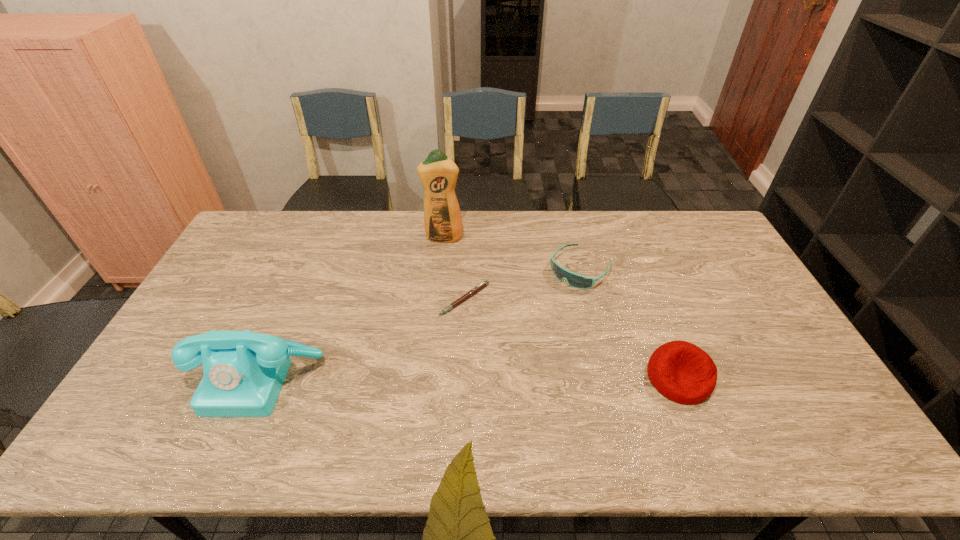
Identify the location of vacant region located at the nib of the shortest object. This screenshot has width=960, height=540. (478, 354).

You are a GUI agent. You are given a task and a screenshot of the screen. Output one action in this format:
    pyautogui.click(x=<x>, y=<y>)
    Task: Click on the free space located 0.080m at the nib of the shortest object
    
    Given the screenshot: What is the action you would take?
    pyautogui.click(x=474, y=338)

Identify the location of blank space located 0.150m on the front-facing side of the second shortest object. (537, 312).

Find the location of a particular element. free space located on the front-facing side of the second shortest object is located at coordinates (491, 357).

Locate an element on the screen. The height and width of the screenshot is (540, 960). vacant region located 0.160m on the front-facing side of the second shortest object is located at coordinates (535, 314).

Locate an element on the screen. free spot located on the label of the tallest object is located at coordinates (442, 331).

This screenshot has height=540, width=960. I want to click on free space located on the label of the tallest object, so click(444, 254).

At what (x,y) coordinates should I click in order to perform the action: click on free space located 0.320m on the label of the tallest object. Please return your answer as a coordinate pair (x, y). This screenshot has width=960, height=540. Looking at the image, I should click on (443, 310).

The height and width of the screenshot is (540, 960). Identify the location of sunglasses at the far edge. (578, 281).

Identify the location of detergent that is at the far edge. (438, 173).